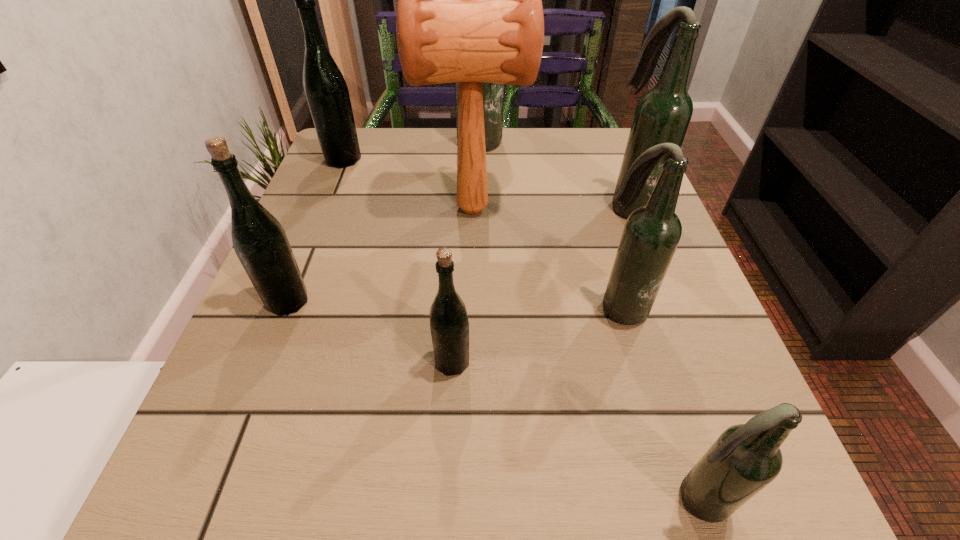
The width and height of the screenshot is (960, 540). I want to click on the nearest dark beer bottle, so click(745, 458).

The width and height of the screenshot is (960, 540). I want to click on the nearest object, so click(x=745, y=458).

At what (x,y) coordinates should I click in order to perform the action: click on vacant region located 0.270m on the left of the farthest dark beer bottle. Please return your answer as a coordinate pair (x, y). The width and height of the screenshot is (960, 540). Looking at the image, I should click on (335, 142).

The width and height of the screenshot is (960, 540). In order to click on vacant space located 0.080m on the strike surface of the mallet in this screenshot , I will do `click(565, 209)`.

At what (x,y) coordinates should I click in order to perform the action: click on vacant area situated 0.180m on the right of the farthest green beer bottle. Please return your answer as a coordinate pair (x, y). Looking at the image, I should click on (438, 159).

Find the location of `vacant space located on the left of the third nearest dark beer bottle`. vacant space located on the left of the third nearest dark beer bottle is located at coordinates (564, 206).

You are a GUI agent. You are given a task and a screenshot of the screen. Output one action in this format:
    pyautogui.click(x=<x>, y=<y>)
    Task: Click on the vacant space located 0.140m on the right of the second biggest green beer bottle
    This screenshot has width=960, height=540.
    Given the screenshot: What is the action you would take?
    pyautogui.click(x=393, y=301)

Locate an element on the screen. The width and height of the screenshot is (960, 540). vacant space located on the back of the third biggest dark beer bottle is located at coordinates (587, 188).

The width and height of the screenshot is (960, 540). Find the location of `vacant space located 0.220m on the back of the second nearest beer bottle`. vacant space located 0.220m on the back of the second nearest beer bottle is located at coordinates (458, 251).

The width and height of the screenshot is (960, 540). Find the location of `free spot located on the back of the smallest dark beer bottle`. free spot located on the back of the smallest dark beer bottle is located at coordinates (623, 269).